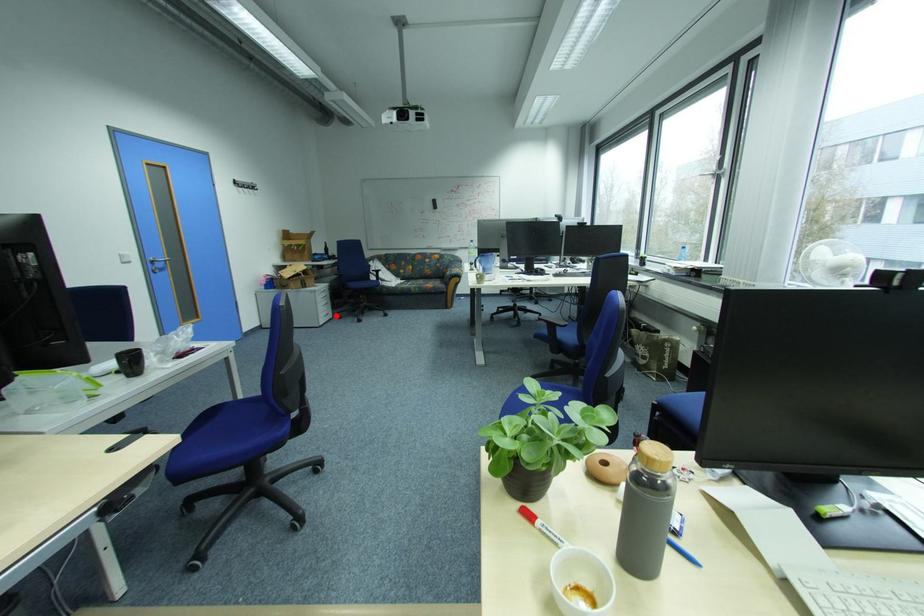
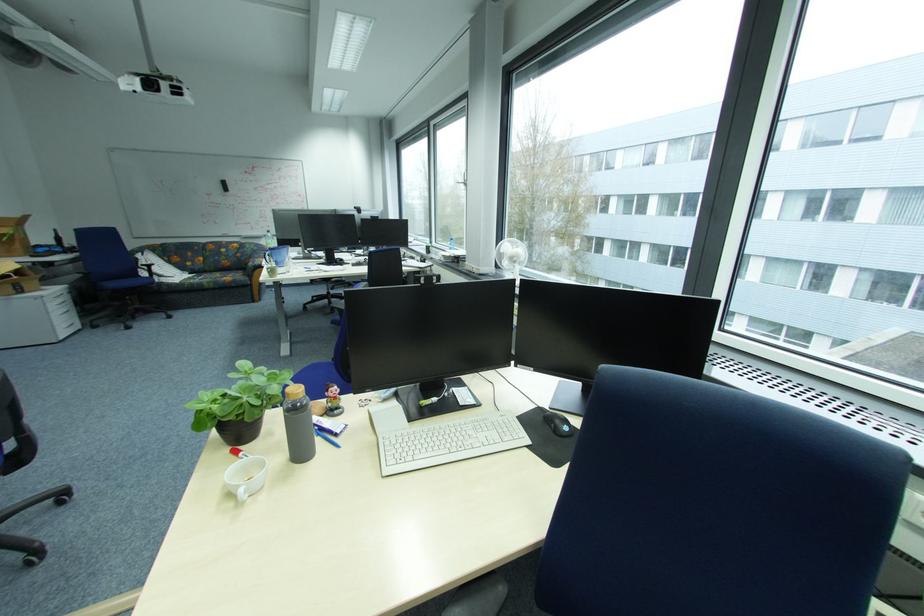
Question: I am providing you with two images of the same scene from different viewpoints. A red point is shown in image1. For the corresponding object point in image2, is it positioned nearer or farther from the camera?

Choices:
 (A) Nearer
 (B) Farther

Answer: (B)